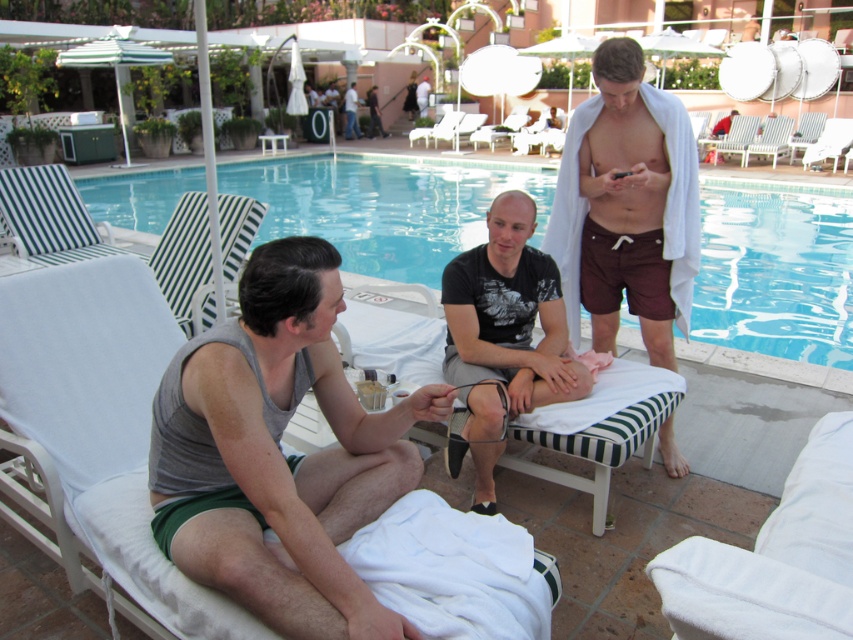
You are a lifeguard standing at the edge of the pool. You see the point marked at coordinates (279,452). What object is located at that point?

The gray fabric tank top at center is located at the point marked by coordinates (279,452).

You are standing at the edge of the pool and want to reach both the point at coordinates point [260,390] and point [599,326]. Which point will you reach first if you walk straight towards them?

You will reach point [260,390] first because it is closer to you than point [599,326].

You are a lifeguard at the poolside and need to retrieve the gray fabric tank top at center for a swimmer. Based on the coordinates provided, in which direction should you move from the center of the pool to reach it?

The gray fabric tank top at center is located at point 0.709 on the x axis and 0.328 on the y axis. Since the x coordinate is greater than 0.5, you should move to the right of the pool center to reach it.